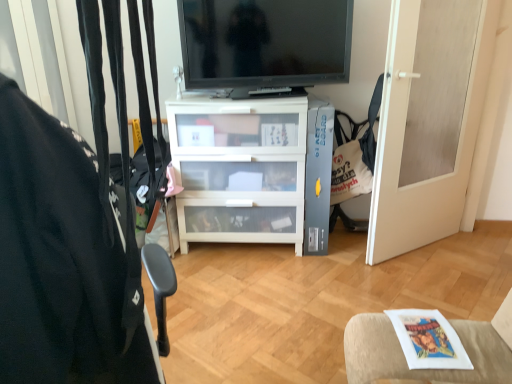
Question: Is black fabric chair at left positioned in front of white fabric cushion at lower right?

Choices:
 (A) no
 (B) yes

Answer: (B)

Question: Is black fabric chair at left touching white fabric cushion at lower right?

Choices:
 (A) yes
 (B) no

Answer: (B)

Question: Would you say black fabric chair at left is a long distance from white fabric cushion at lower right?

Choices:
 (A) yes
 (B) no

Answer: (A)

Question: Is white fabric cushion at lower right inside black fabric chair at left?

Choices:
 (A) no
 (B) yes

Answer: (A)

Question: From a real-world perspective, is black fabric chair at left positioned under white fabric cushion at lower right based on gravity?

Choices:
 (A) yes
 (B) no

Answer: (B)

Question: In terms of height, does black fabric chair at left look taller or shorter compared to white matte door at right?

Choices:
 (A) short
 (B) tall

Answer: (A)

Question: From a real-world perspective, relative to white matte door at right, is black fabric chair at left vertically above or below?

Choices:
 (A) below
 (B) above

Answer: (B)

Question: Based on their sizes in the image, would you say black fabric chair at left is bigger or smaller than white matte door at right?

Choices:
 (A) big
 (B) small

Answer: (B)

Question: In the image, is black fabric chair at left positioned in front of or behind white matte door at right?

Choices:
 (A) behind
 (B) front

Answer: (B)

Question: From the image's perspective, is white fabric cushion at lower right located above or below white fabric bag at right?

Choices:
 (A) above
 (B) below

Answer: (B)

Question: Would you say white fabric cushion at lower right is to the left or to the right of white fabric bag at right in the picture?

Choices:
 (A) left
 (B) right

Answer: (A)

Question: Is point (505, 314) closer or farther from the camera than point (340, 173)?

Choices:
 (A) farther
 (B) closer

Answer: (B)

Question: In terms of size, does white fabric cushion at lower right appear bigger or smaller than white fabric bag at right?

Choices:
 (A) big
 (B) small

Answer: (B)

Question: In terms of size, does black fabric chair at left appear bigger or smaller than black glossy tv at upper center?

Choices:
 (A) big
 (B) small

Answer: (B)

Question: Is black fabric chair at left in front of or behind black glossy tv at upper center in the image?

Choices:
 (A) behind
 (B) front

Answer: (B)